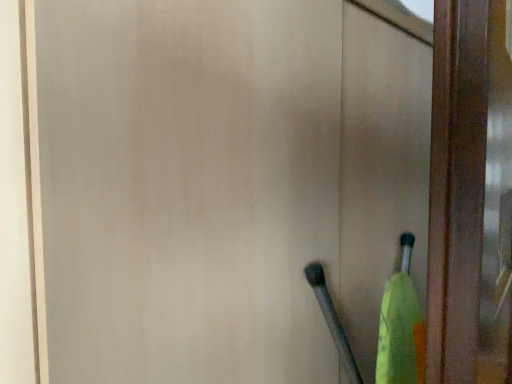
Identify the location of wooden door at right. The height and width of the screenshot is (384, 512). (470, 195).

The image size is (512, 384). What do you see at coordinates (470, 195) in the screenshot? I see `wooden door at right` at bounding box center [470, 195].

Identify the location of wooden door at right. This screenshot has height=384, width=512. (470, 195).